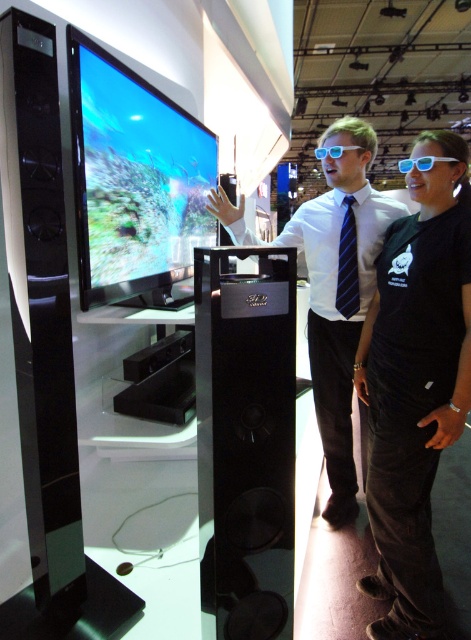
Question: Considering the relative positions of matte black speaker at center and blue striped tie at center in the image provided, where is matte black speaker at center located with respect to blue striped tie at center?

Choices:
 (A) right
 (B) left

Answer: (B)

Question: Does black corduroy pants at lower right have a larger size compared to matte black speaker at center?

Choices:
 (A) yes
 (B) no

Answer: (B)

Question: Which of these objects is positioned farthest from the blue striped tie at center?

Choices:
 (A) shiny glossy screen at center
 (B) matte black speaker at center

Answer: (A)

Question: Is matte black speaker at center positioned before blue striped tie at center?

Choices:
 (A) no
 (B) yes

Answer: (B)

Question: Which point is farther from the camera taking this photo?

Choices:
 (A) (392, 541)
 (B) (343, 228)
 (C) (136, 99)
 (D) (317, 148)

Answer: (B)

Question: Which of these objects is positioned farthest from the white plastic goggles at center?

Choices:
 (A) matte black speaker at center
 (B) shiny glossy screen at center

Answer: (B)